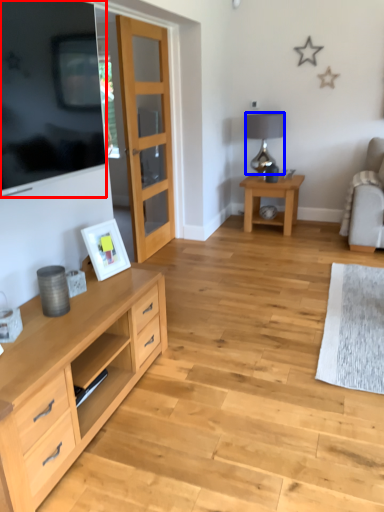
Question: Among these objects, which one is farthest to the camera, television (highlighted by a red box) or lamp (highlighted by a blue box)?

Choices:
 (A) television
 (B) lamp

Answer: (B)